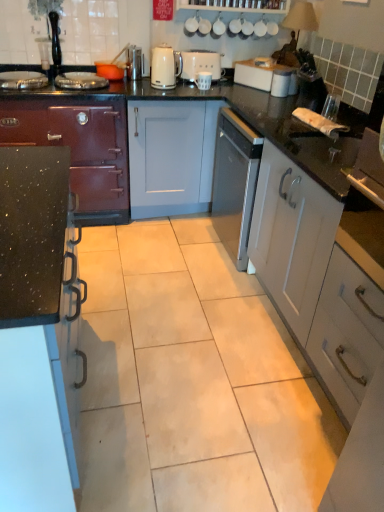
Question: Is metallic silver toaster at upper center, which is counted as the 1th appliance, starting from the left, closer to the viewer compared to black speckled countertop at left, the 2th cabinetry viewed from the left?

Choices:
 (A) no
 (B) yes

Answer: (A)

Question: From a real-world perspective, does metallic silver toaster at upper center, which ranks as the 3th appliance in right-to-left order, sit lower than black speckled countertop at left, positioned as the second cabinetry in right-to-left order?

Choices:
 (A) no
 (B) yes

Answer: (A)

Question: Is metallic silver toaster at upper center, which ranks as the 3th appliance in right-to-left order, far from black speckled countertop at left, the 2th cabinetry viewed from the left?

Choices:
 (A) no
 (B) yes

Answer: (B)

Question: Is metallic silver toaster at upper center, which is counted as the 1th appliance, starting from the left, outside black speckled countertop at left, the 2th cabinetry viewed from the left?

Choices:
 (A) yes
 (B) no

Answer: (A)

Question: Can you confirm if metallic silver toaster at upper center, which ranks as the 3th appliance in right-to-left order, is positioned to the right of black speckled countertop at left, positioned as the second cabinetry in right-to-left order?

Choices:
 (A) no
 (B) yes

Answer: (B)

Question: In terms of height, does black speckled countertop at left, positioned as the second cabinetry in right-to-left order, look taller or shorter compared to white matte cabinet at right, which is the 1th cabinetry in right-to-left order?

Choices:
 (A) short
 (B) tall

Answer: (A)

Question: In the image, is black speckled countertop at left, the 2th cabinetry viewed from the left, positioned in front of or behind white matte cabinet at right, which is the 1th cabinetry in right-to-left order?

Choices:
 (A) front
 (B) behind

Answer: (A)

Question: From a real-world perspective, relative to white matte cabinet at right, which is the 1th cabinetry in right-to-left order, is black speckled countertop at left, the 2th cabinetry viewed from the left, vertically above or below?

Choices:
 (A) above
 (B) below

Answer: (B)

Question: Looking at the image, does black speckled countertop at left, the 2th cabinetry viewed from the left, seem bigger or smaller compared to white matte cabinet at right, which is the 1th cabinetry in right-to-left order?

Choices:
 (A) small
 (B) big

Answer: (B)

Question: Does point (127, 65) appear closer or farther from the camera than point (213, 60)?

Choices:
 (A) farther
 (B) closer

Answer: (B)

Question: In terms of width, does metallic silver toaster at upper center, which ranks as the 3th appliance in right-to-left order, look wider or thinner when compared to white matte toaster at center, which is counted as the second appliance, starting from the left?

Choices:
 (A) wide
 (B) thin

Answer: (B)

Question: In terms of size, does metallic silver toaster at upper center, which is counted as the 1th appliance, starting from the left, appear bigger or smaller than white matte toaster at center, arranged as the 2th appliance when viewed from the right?

Choices:
 (A) big
 (B) small

Answer: (B)

Question: From a real-world perspective, is metallic silver toaster at upper center, which ranks as the 3th appliance in right-to-left order, above or below white matte toaster at center, which is counted as the second appliance, starting from the left?

Choices:
 (A) above
 (B) below

Answer: (A)

Question: From the image's perspective, is white matte mug at center, positioned as the 3th appliance in left-to-right order, positioned above or below white glossy kettle at upper center?

Choices:
 (A) below
 (B) above

Answer: (A)

Question: Would you say white matte mug at center, which is counted as the 1th appliance, starting from the right, is inside or outside white glossy kettle at upper center?

Choices:
 (A) outside
 (B) inside

Answer: (A)